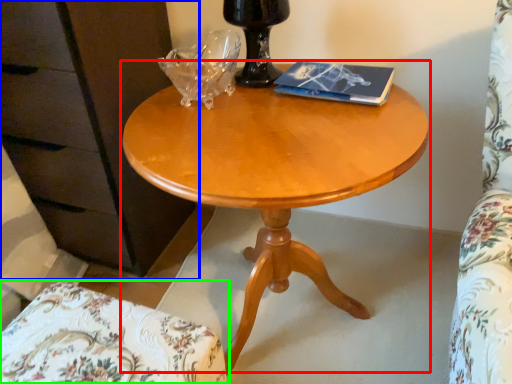
Question: Considering the real-world distances, which object is farthest from coffee table (highlighted by a red box)? dresser (highlighted by a blue box) or chair (highlighted by a green box)?

Choices:
 (A) dresser
 (B) chair

Answer: (A)